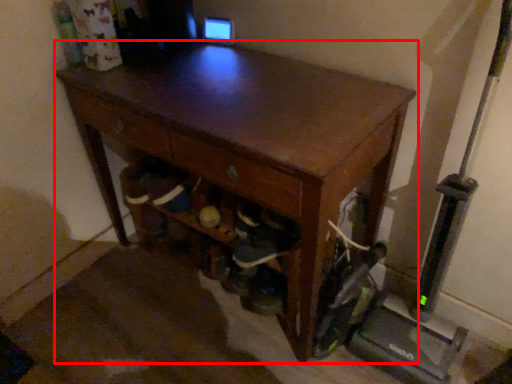
Question: From the image's perspective, what is the correct spatial relationship of desk (annotated by the red box) in relation to drawer?

Choices:
 (A) above
 (B) below

Answer: (B)